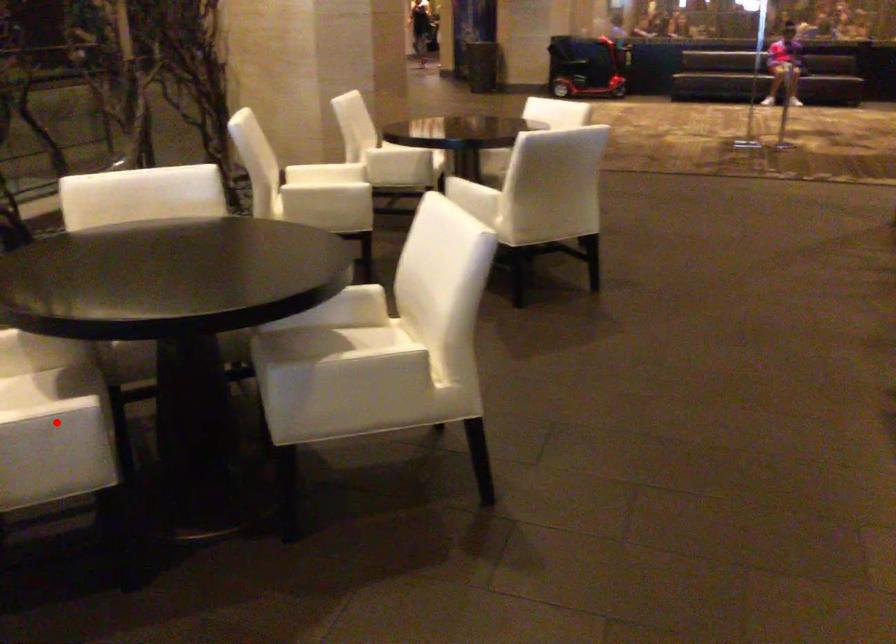
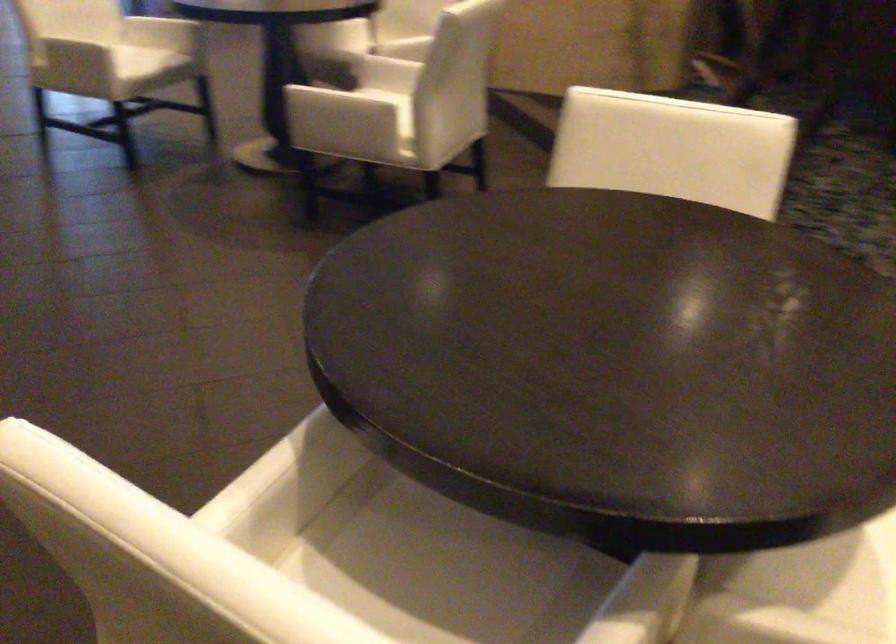
Question: I am providing you with two images of the same scene from different viewpoints. A red point is marked on the first image. At the location where the point appears in image 1, is it still visible in image 2?

Choices:
 (A) Yes
 (B) No

Answer: (B)